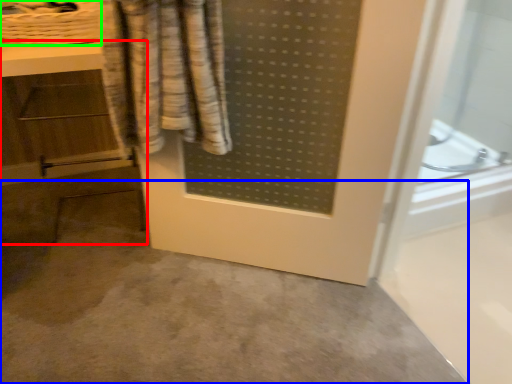
Question: Based on their relative distances, which object is nearer to vanity (highlighted by a red box)? Choose from concrete (highlighted by a blue box) and basket (highlighted by a green box).

Choices:
 (A) concrete
 (B) basket

Answer: (B)